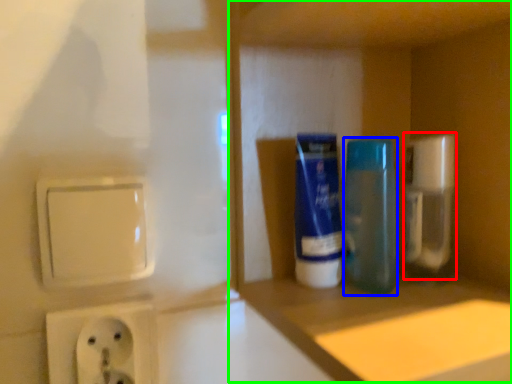
Question: Estimate the real-world distances between objects in this image. Which object is closer to cleaning product (highlighted by a red box), mouthwash (highlighted by a blue box) or cabinet (highlighted by a green box)?

Choices:
 (A) mouthwash
 (B) cabinet

Answer: (A)